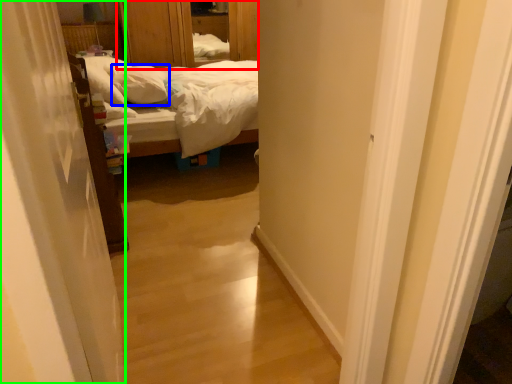
Question: Based on their relative distances, which object is nearer to dresser (highlighted by a red box)? Choose from pillow (highlighted by a blue box) and curtain (highlighted by a green box).

Choices:
 (A) pillow
 (B) curtain

Answer: (A)